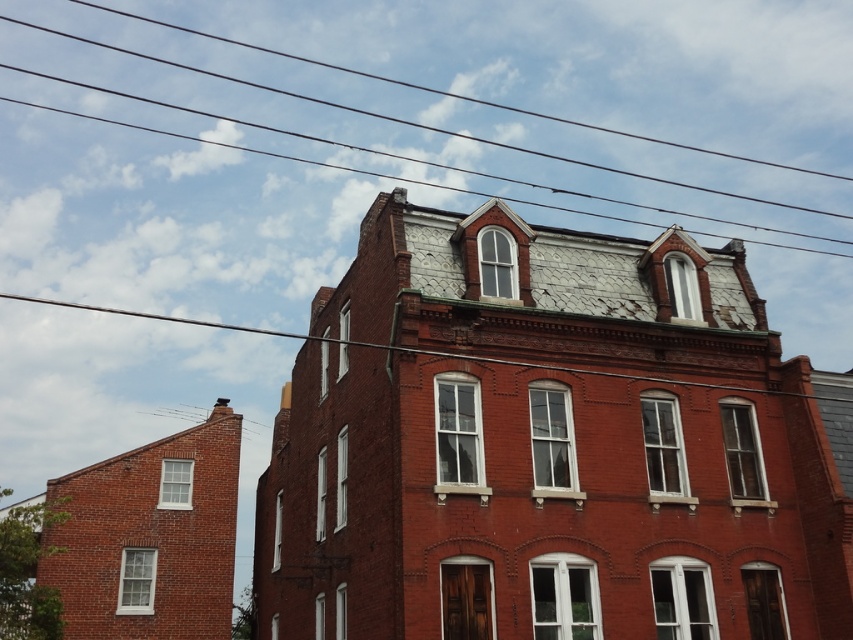
Based on the photo, which is below, black wire at upper center or metallic wire at upper center?

metallic wire at upper center is lower down.

Who is shorter, black wire at upper center or metallic wire at upper center?

metallic wire at upper center is shorter.

The image size is (853, 640). What do you see at coordinates (418, 122) in the screenshot? I see `black wire at upper center` at bounding box center [418, 122].

Image resolution: width=853 pixels, height=640 pixels. I want to click on black wire at upper center, so click(x=418, y=122).